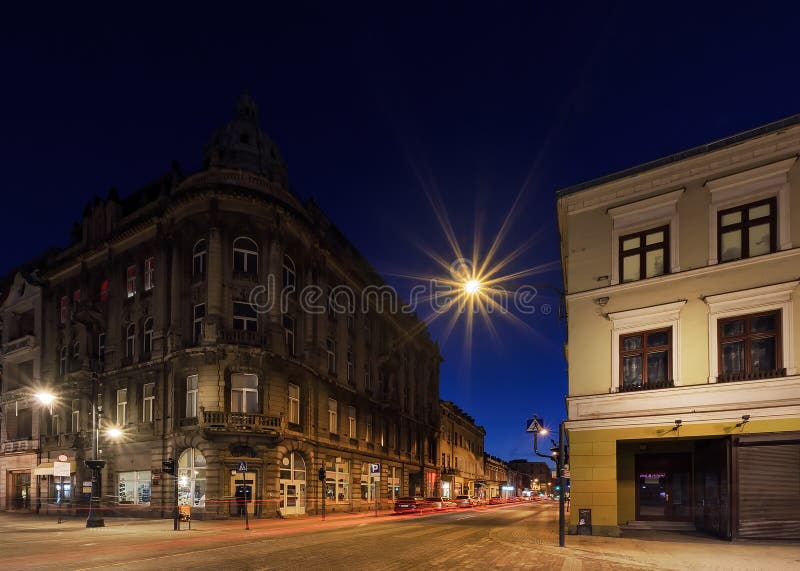
I want to click on sun-like light, so click(472, 289).